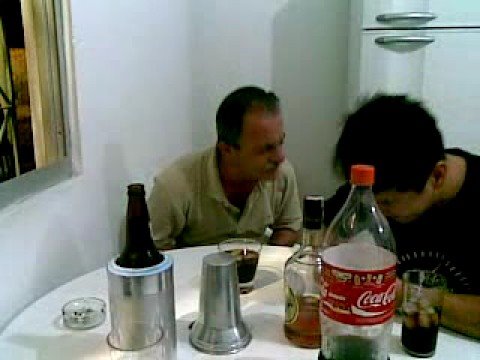
Where is `wall behind men`? The image size is (480, 360). wall behind men is located at coordinates (301, 31).